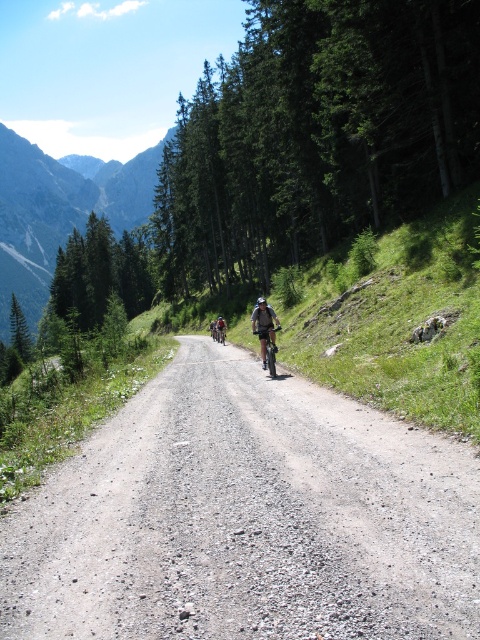
You are a hiker planning to take a photo of the green forested mountain at upper left and the dusty gravel road at center. Which object should you focus on first if you want to capture both in a single frame without moving the camera?

The dusty gravel road at center has a lesser height compared to the green forested mountain at upper left, so you should focus on the green forested mountain at upper left first since it is taller and will require more depth of field adjustment.

You are standing at the starting point of the mountain biking trail and want to reach the end of the trail. There are two points marked on the trail, point (289, 385) and point (259, 310). Which point should you head towards first if you want to reach the end of the trail as quickly as possible?

You should head towards point (289, 385) first because it is closer to the viewer, meaning it is the first point along the trail that you need to pass before reaching the end.